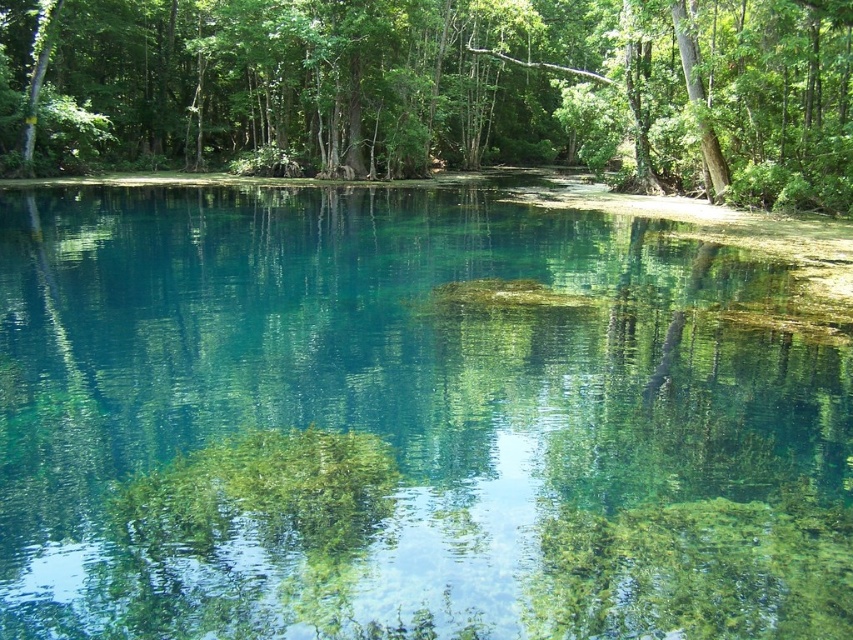
You are standing at the edge of the scene and want to compare the sizes of the clear glassy water at center and the green leafy tree at upper center. Based on the scene, which one appears larger?

The green leafy tree at upper center appears larger than the clear glassy water at center.

You are a photographer positioned at the origin point of the image coordinate system. You want to capture the clear glassy water at center in your shot. What are the coordinates where you should aim your camera?

The clear glassy water at center is located at coordinates point (405, 422), so you should aim your camera at those coordinates to capture it.

You are a bird flying over the serene natural scene. You see the clear glassy water at center and the green leafy tree at upper center. Which object is located above the other?

The green leafy tree at upper center is located above the clear glassy water at center.